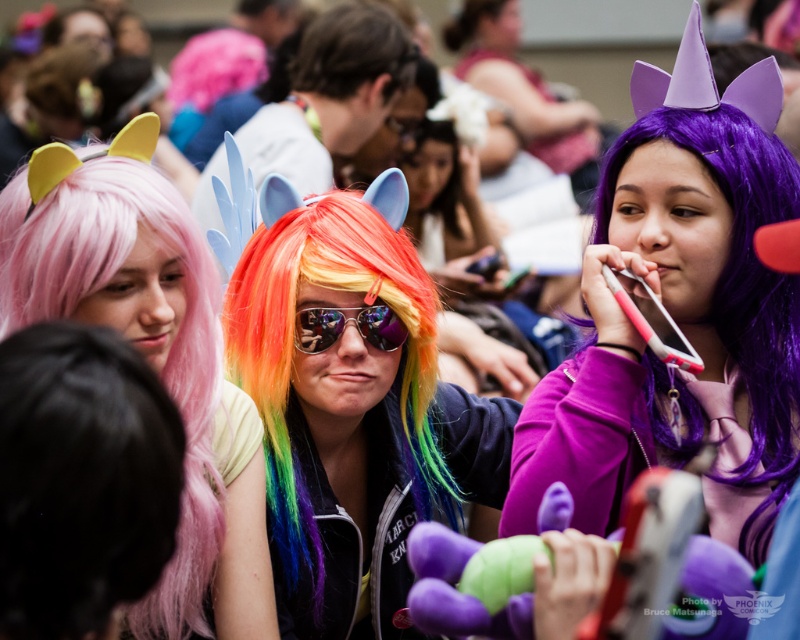
Question: Estimate the real-world distances between objects in this image. Which object is farther from the purple matte wig at center?

Choices:
 (A) pink wig at upper left
 (B) purple matte wig at upper right
 (C) sunglasses at center

Answer: (B)

Question: Can you confirm if pink fluffy wig at lower left is positioned to the right of blonde hair at upper center?

Choices:
 (A) yes
 (B) no

Answer: (B)

Question: Which of the following is the closest to the observer?

Choices:
 (A) (494, 10)
 (B) (698, 200)
 (C) (60, 621)
 (D) (514, 419)

Answer: (C)

Question: Is pink wig at upper left closer to camera compared to brown matte hair at center?

Choices:
 (A) yes
 (B) no

Answer: (A)

Question: Which point is closer to the camera?

Choices:
 (A) rainbow wig at center
 (B) pink fluffy wig at lower left

Answer: (B)

Question: Is the position of pink fluffy wig at lower left more distant than that of brown matte hair at center?

Choices:
 (A) yes
 (B) no

Answer: (B)